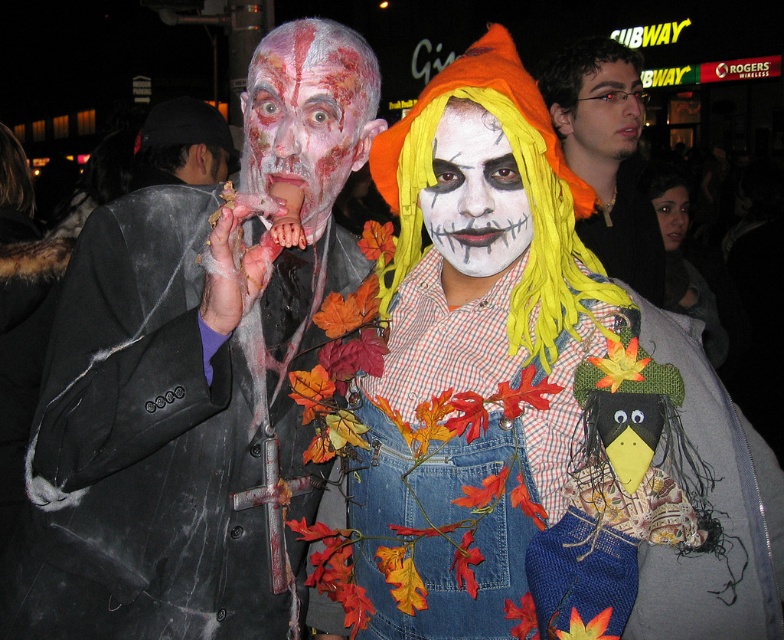
You are a photographer trying to capture a wide shot of the black fabric at left and the smooth skin face at upper center. Which object should you focus on first to ensure both are in frame?

The black fabric at left is wider than the smooth skin face at upper center, so focus on the black fabric at left first to accommodate its larger width.

You are a photographer setting up for a group photo. You need to position yourself between the matte black hair at upper center and the black fabric at left so that you can capture both subjects clearly. Given that your camera has a maximum focus range of 2 meters, will you be able to position yourself within that range to include both subjects in the shot?

The distance between the matte black hair at upper center and the black fabric at left is 1.81 meters. Since your camera has a maximum focus range of 2 meters, positioning yourself within that range would allow you to capture both subjects clearly as the distance is within the camera capabilities.

You are at a costume party and need to find the scarecrow costume. You see the matte black suit at left and the smooth skin face at center. Which one is positioned to the right side of the other?

The matte black suit at left is to the left of smooth skin face at center, so the smooth skin face at center is positioned to the right side of the matte black suit at left.